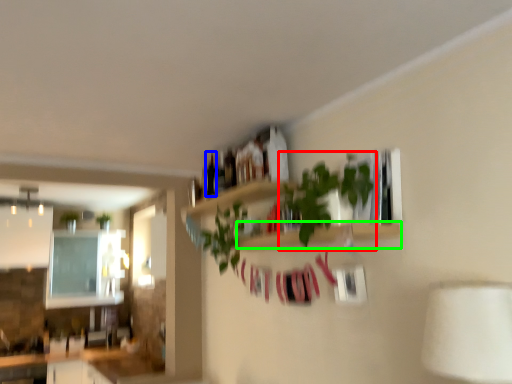
Question: Considering the real-world distances, which object is farthest from houseplant (highlighted by a red box)? bottle (highlighted by a blue box) or shelf (highlighted by a green box)?

Choices:
 (A) bottle
 (B) shelf

Answer: (A)